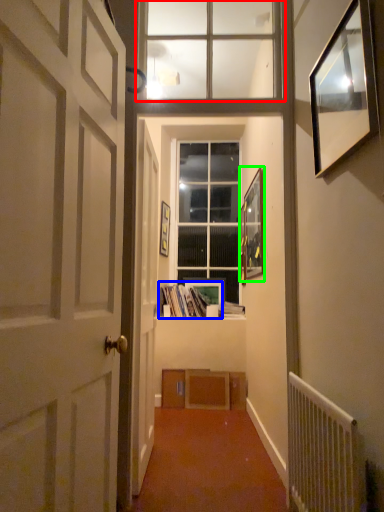
Question: Which is farther away from window (highlighted by a red box)? book (highlighted by a blue box) or picture frame (highlighted by a green box)?

Choices:
 (A) book
 (B) picture frame

Answer: (A)